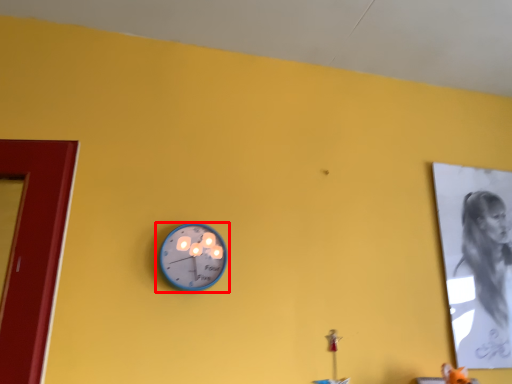
Question: From the image's perspective, where is wall clock (annotated by the red box) located relative to person?

Choices:
 (A) above
 (B) below

Answer: (A)